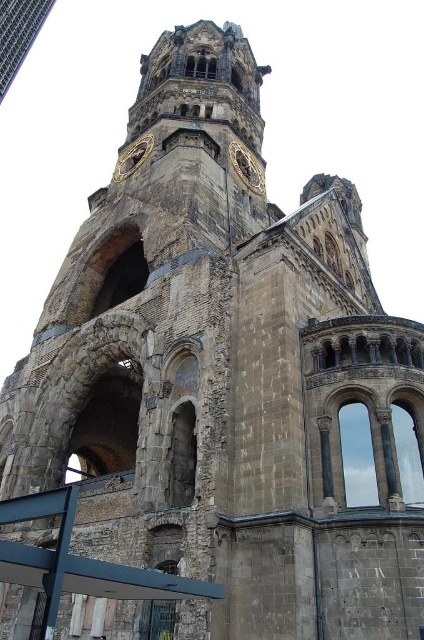
Question: Does golden stone clock at upper center lie behind gold metallic clock at upper center?

Choices:
 (A) no
 (B) yes

Answer: (B)

Question: Is golden stone clock at upper center positioned behind gold metallic clock at upper center?

Choices:
 (A) no
 (B) yes

Answer: (B)

Question: Which point appears closest to the camera in this image?

Choices:
 (A) (x=131, y=168)
 (B) (x=248, y=156)

Answer: (A)

Question: Can you confirm if golden stone clock at upper center is wider than gold metallic clock at upper center?

Choices:
 (A) no
 (B) yes

Answer: (A)

Question: Which point appears farthest from the camera in this image?

Choices:
 (A) (256, 176)
 (B) (133, 163)

Answer: (A)